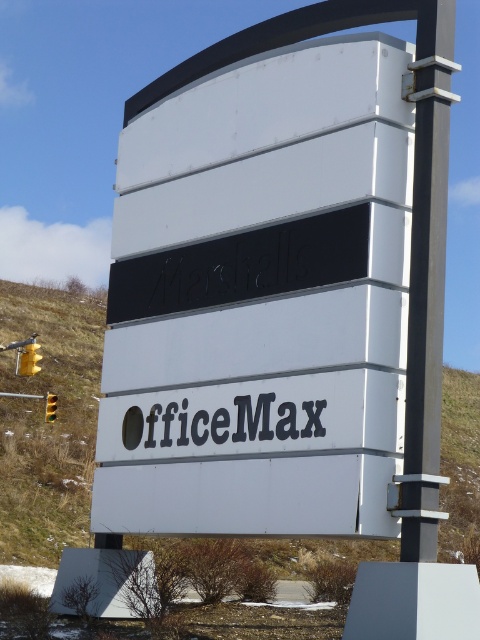
You are standing in front of the sign and want to locate two specific points marked on it. The first point is at coordinates point (80, 497) and the second is at point (417, 195). From your vantage point, which point appears closer to you?

Point (417, 195) appears closer because it is in front of point (80, 497).